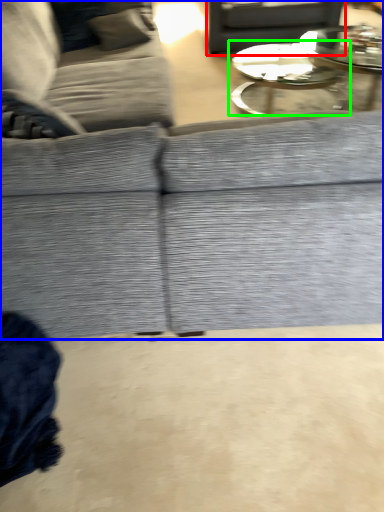
Question: Which is nearer to the gray (highlighted by a red box)? studio couch (highlighted by a blue box) or coffee table (highlighted by a green box).

Choices:
 (A) studio couch
 (B) coffee table

Answer: (B)